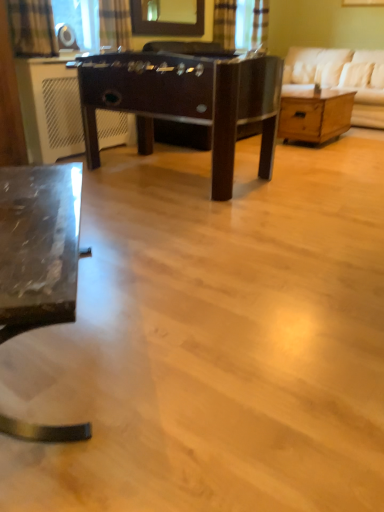
Question: From a real-world perspective, is plaid fabric curtain at upper center, the 2th curtain positioned from the back, physically above glossy glass mirror at upper center?

Choices:
 (A) no
 (B) yes

Answer: (A)

Question: Is plaid fabric curtain at upper center, placed as the 2th curtain when sorted from front to back, aimed at glossy glass mirror at upper center?

Choices:
 (A) yes
 (B) no

Answer: (B)

Question: Is plaid fabric curtain at upper center, the 2th curtain positioned from the top, next to glossy glass mirror at upper center?

Choices:
 (A) no
 (B) yes

Answer: (A)

Question: Can you confirm if plaid fabric curtain at upper center, the 2th curtain positioned from the back, is shorter than glossy glass mirror at upper center?

Choices:
 (A) yes
 (B) no

Answer: (B)

Question: Considering the relative sizes of plaid fabric curtain at upper center, the 2th curtain positioned from the back, and glossy glass mirror at upper center in the image provided, is plaid fabric curtain at upper center, the 2th curtain positioned from the back, bigger than glossy glass mirror at upper center?

Choices:
 (A) no
 (B) yes

Answer: (A)

Question: In terms of width, does plaid fabric curtain at upper left, which is counted as the 1th curtain, starting from the left, look wider or thinner when compared to plaid fabric curtain at upper center, the 2th curtain when ordered from left to right?

Choices:
 (A) wide
 (B) thin

Answer: (A)

Question: From their relative heights in the image, would you say plaid fabric curtain at upper left, the 3th curtain from the back, is taller or shorter than plaid fabric curtain at upper center, placed as the 2th curtain when sorted from front to back?

Choices:
 (A) tall
 (B) short

Answer: (B)

Question: Considering the positions of point pyautogui.click(x=29, y=31) and point pyautogui.click(x=120, y=20), is point pyautogui.click(x=29, y=31) closer or farther from the camera than point pyautogui.click(x=120, y=20)?

Choices:
 (A) closer
 (B) farther

Answer: (A)

Question: Is plaid fabric curtain at upper left, the third curtain when ordered from right to left, inside the boundaries of plaid fabric curtain at upper center, positioned as the 2th curtain in bottom-to-top order, or outside?

Choices:
 (A) inside
 (B) outside

Answer: (B)

Question: From their relative heights in the image, would you say plaid fabric curtain at upper center, the 2th curtain positioned from the back, is taller or shorter than white fabric couch at upper right?

Choices:
 (A) tall
 (B) short

Answer: (B)

Question: From the image's perspective, relative to white fabric couch at upper right, is plaid fabric curtain at upper center, placed as the 2th curtain when sorted from front to back, above or below?

Choices:
 (A) below
 (B) above

Answer: (A)

Question: Considering the positions of point pos(105,0) and point pos(289,64), is point pos(105,0) closer or farther from the camera than point pos(289,64)?

Choices:
 (A) farther
 (B) closer

Answer: (B)

Question: Considering the positions of plaid fabric curtain at upper center, the 2th curtain positioned from the top, and white fabric couch at upper right in the image, is plaid fabric curtain at upper center, the 2th curtain positioned from the top, bigger or smaller than white fabric couch at upper right?

Choices:
 (A) big
 (B) small

Answer: (B)

Question: Is white fabric couch at upper right inside or outside of glossy glass mirror at upper center?

Choices:
 (A) outside
 (B) inside

Answer: (A)

Question: Considering the positions of white fabric couch at upper right and glossy glass mirror at upper center in the image, is white fabric couch at upper right taller or shorter than glossy glass mirror at upper center?

Choices:
 (A) short
 (B) tall

Answer: (B)